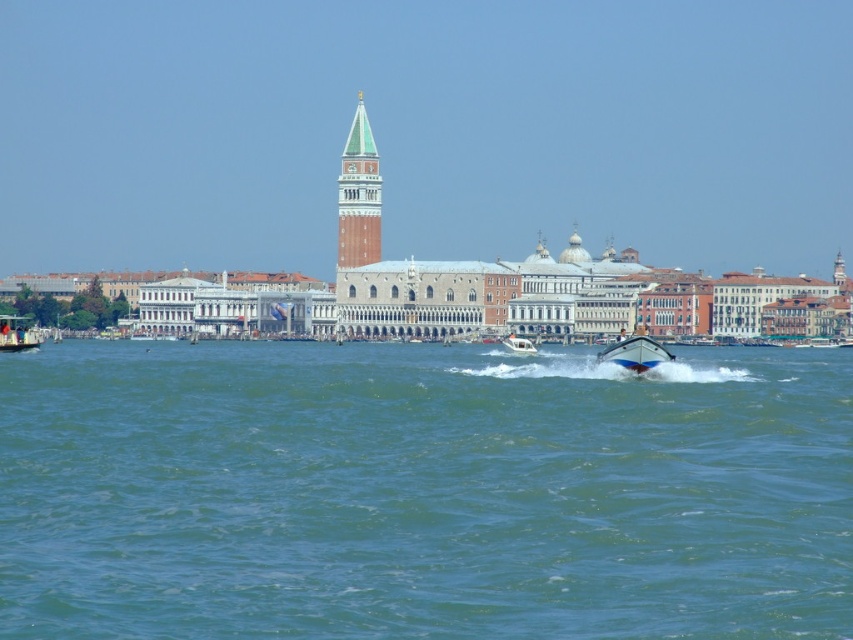
You are standing at the point with coordinates (x=16, y=333) in the image. What object are you standing on?

You are standing on the metallic silver boat at lower left.

You are a tourist standing on the pier and want to take a photo of the white glossy motorboat at center and the green marble tower at center. Which object should you place closer to the front of your photo frame to include both in the shot?

To include both the white glossy motorboat at center and the green marble tower at center in your photo, you should place the green marble tower at center closer to the front of your photo frame since the white glossy motorboat at center is behind it.